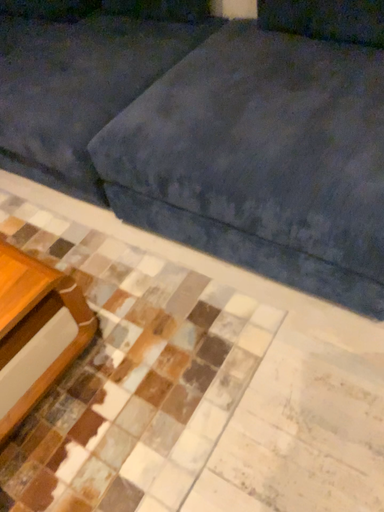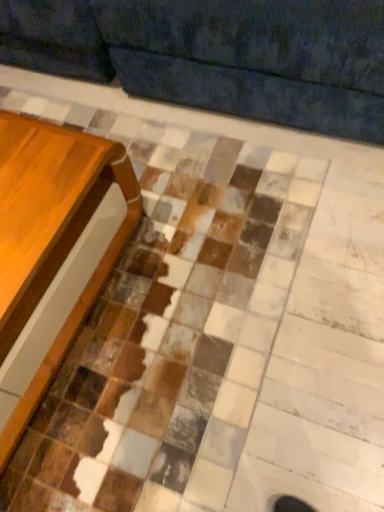
Question: Which way did the camera rotate in the video?

Choices:
 (A) rotated left
 (B) rotated right

Answer: (B)